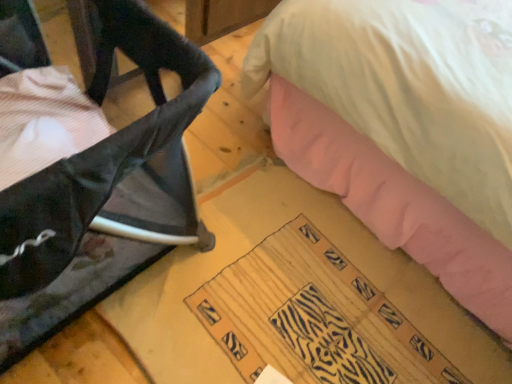
You are a GUI agent. You are given a task and a screenshot of the screen. Output one action in this format:
    pyautogui.click(x=<x>, y=<y>)
    Task: Click on the free spot above zebra-patterned fabric at lower center (from a real-world perspective)
    This screenshot has width=512, height=384.
    Given the screenshot: What is the action you would take?
    pyautogui.click(x=315, y=319)